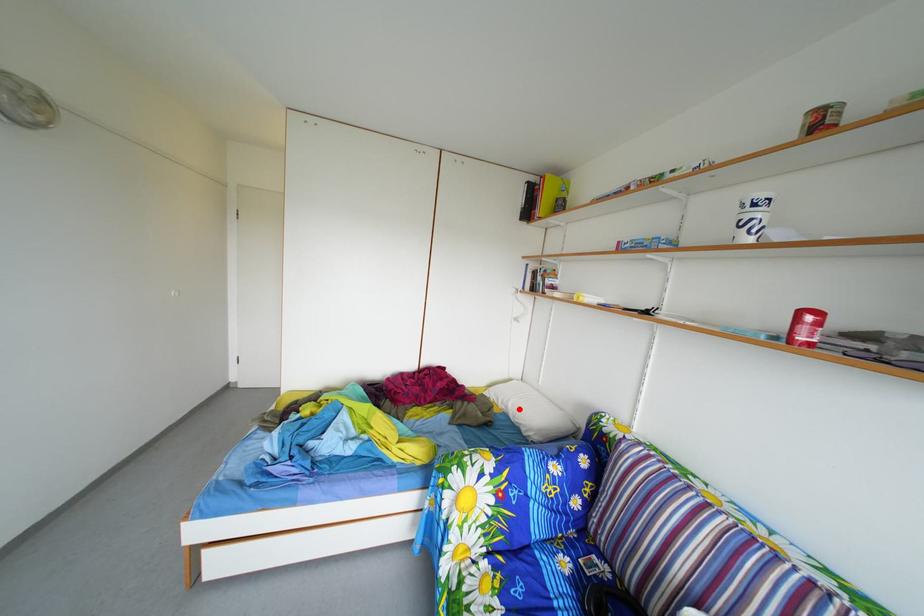
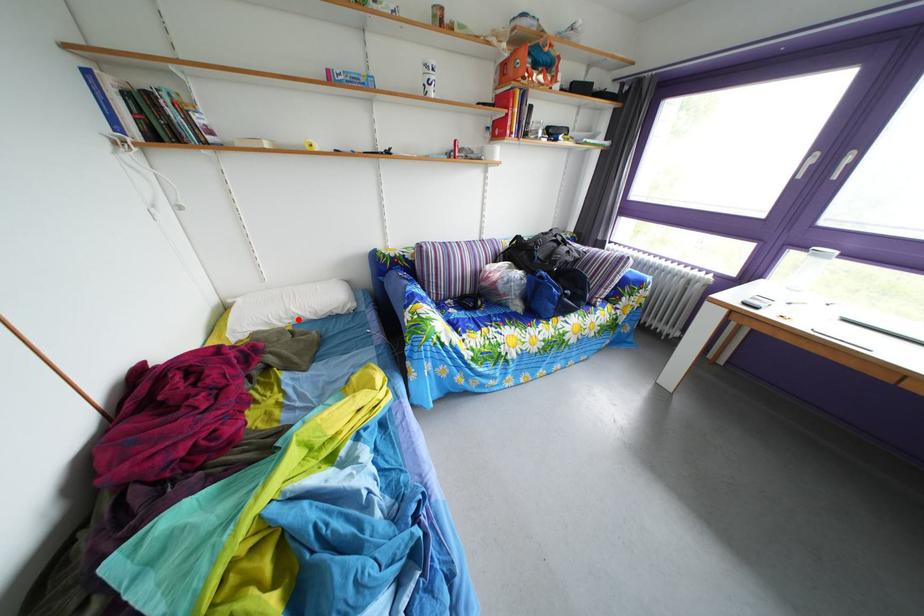
I am providing you with two images of the same scene from different viewpoints. A red point is marked on the first image and another point is marked on the second image. Is the marked point in image1 the same physical position as the marked point in image2?

Yes